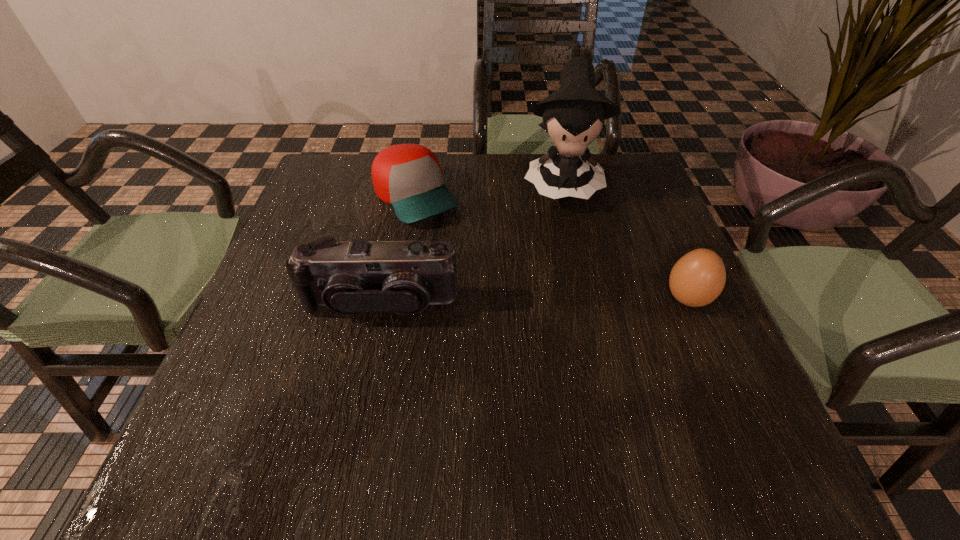
Where is `free spot on the desktop that is between the camcorder and the boiled egg and is positioned at the face of the doll`? This screenshot has width=960, height=540. free spot on the desktop that is between the camcorder and the boiled egg and is positioned at the face of the doll is located at coordinates (567, 301).

Find the location of a particular element. vacant space on the desktop that is between the camcorder and the rightmost object and is positioned at the brim of the baseball cap is located at coordinates (505, 301).